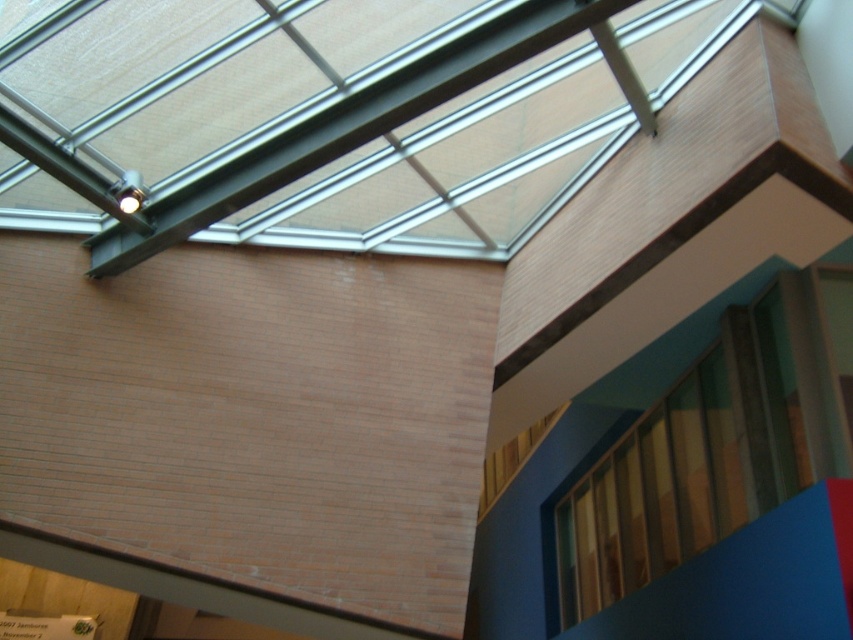
Question: Is wooden textured window at upper right to the left of wooden at upper right from the viewer's perspective?

Choices:
 (A) yes
 (B) no

Answer: (B)

Question: Does wooden textured window at upper right appear over wooden at upper right?

Choices:
 (A) no
 (B) yes

Answer: (B)

Question: Is the position of wooden textured window at upper right less distant than that of wooden at upper right?

Choices:
 (A) no
 (B) yes

Answer: (B)

Question: Which object is closer to the camera taking this photo?

Choices:
 (A) wooden textured window at upper right
 (B) wooden at upper right

Answer: (A)

Question: Which point is farther to the camera?

Choices:
 (A) (593, 548)
 (B) (509, 477)

Answer: (B)

Question: Which point is farther to the camera?

Choices:
 (A) wooden at upper right
 (B) wooden textured window at upper right

Answer: (A)